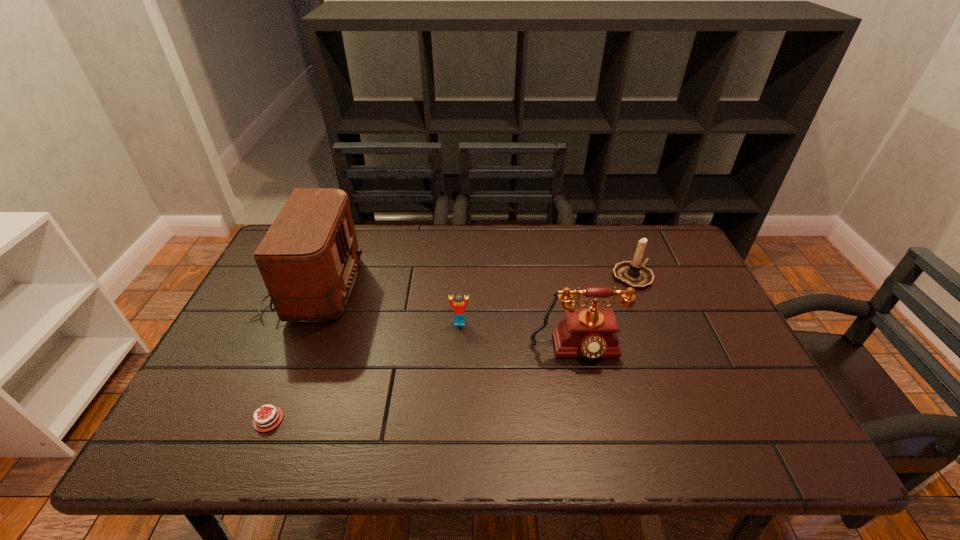
You are a GUI agent. You are given a task and a screenshot of the screen. Output one action in this format:
    pyautogui.click(x=<x>, y=<y>)
    Task: Click on the free point located 0.070m on the dial of the fourth shortest object
    
    Given the screenshot: What is the action you would take?
    pyautogui.click(x=586, y=394)

Image resolution: width=960 pixels, height=540 pixels. I want to click on vacant point located on the front of the candle holder, so click(x=648, y=314).

This screenshot has height=540, width=960. In order to click on vacant space situated on the face of the Lego in this screenshot , I will do click(x=459, y=349).

At what (x,y) coordinates should I click in order to perform the action: click on vacant space situated 0.070m on the back of the chocolate cake. Please return your answer as a coordinate pair (x, y). Looking at the image, I should click on (290, 366).

Identify the location of radio receiver that is positioned at the far edge. This screenshot has height=540, width=960. (308, 259).

Image resolution: width=960 pixels, height=540 pixels. Find the location of `candle holder that is at the far edge`. candle holder that is at the far edge is located at coordinates (634, 274).

You are a GUI agent. You are given a task and a screenshot of the screen. Output one action in this format:
    pyautogui.click(x=<x>, y=<y>)
    Task: Click on the object that is positioned at the near edge
    
    Given the screenshot: What is the action you would take?
    pyautogui.click(x=271, y=416)

The image size is (960, 540). What are the coordinates of `radio receiver present at the left edge` in the screenshot? It's located at tap(308, 259).

The height and width of the screenshot is (540, 960). In order to click on chocolate cake present at the left edge in this screenshot , I will do `click(271, 416)`.

Locate an element on the screen. object that is positioned at the right edge is located at coordinates (634, 274).